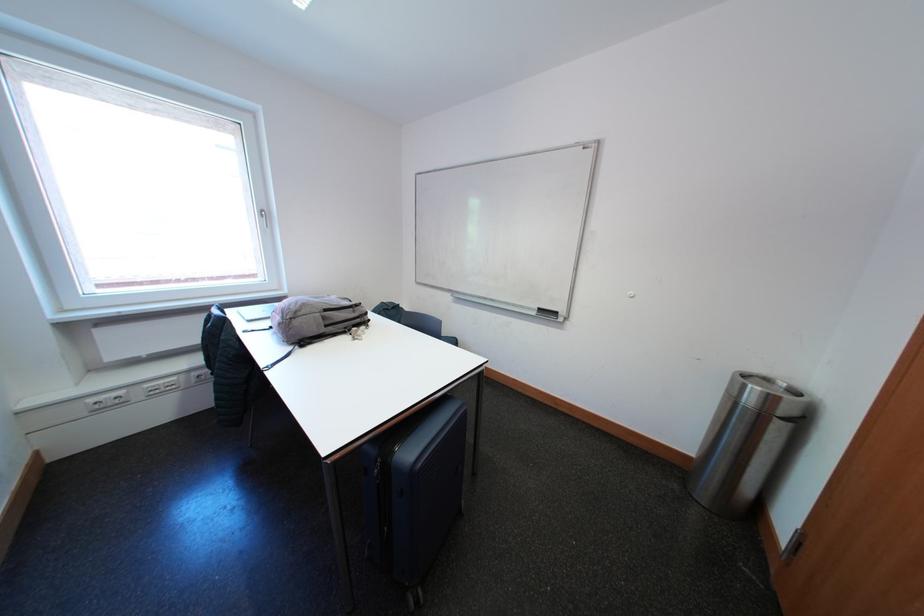
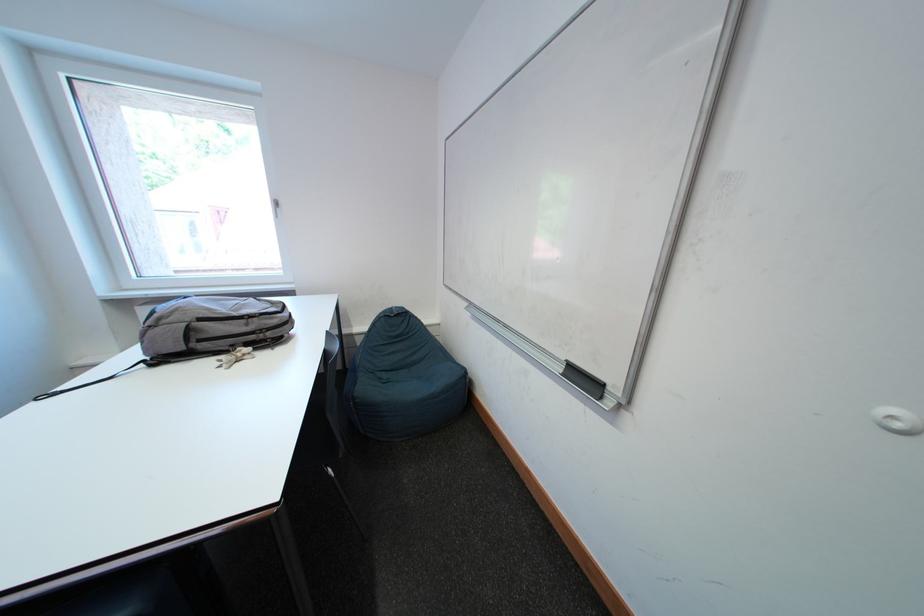
Find the pixel in the second image that matches point (360, 313) in the first image.

(252, 325)